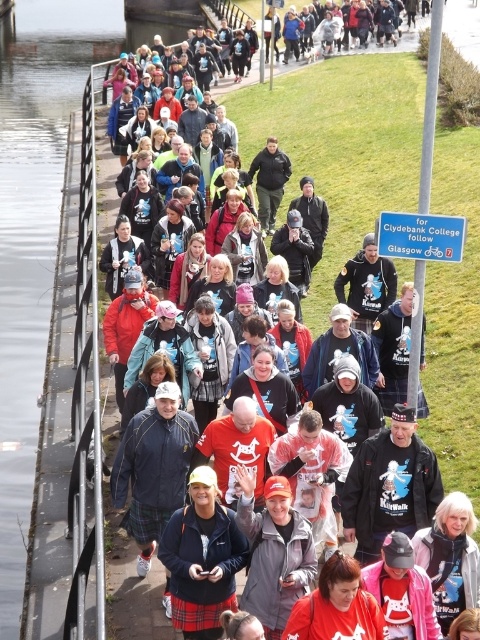
You are organizing a photo shoot along the riverside path. You have a large banner that needs to be placed near the smooth concrete waterway at left and the plaid skirt at center. Which object should you place the banner next to if you want it to be more noticeable due to its size?

The smooth concrete waterway at left is larger in size than the plaid skirt at center, so placing the banner next to the smooth concrete waterway at left would make it more noticeable due to the object being larger.

You are a participant in the event and want to take a shortcut to the rest area located to the right of the plaid skirt at center. Which direction should you head relative to the smooth concrete waterway at left?

Since the smooth concrete waterway at left is to the left of the plaid skirt at center, you should head to the right of the smooth concrete waterway at left to reach the rest area located to the right of the plaid skirt at center.

You are a photographer trying to capture a clear shot of the plaid skirt at center and the smooth concrete waterway at left. Based on their positions, which object should you focus on first to ensure both are in the frame?

The plaid skirt at center is behind the smooth concrete waterway at left, so you should focus on the smooth concrete waterway at left first to ensure both are in the frame.